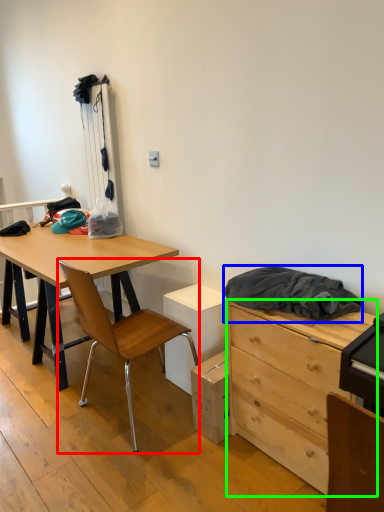
Question: Based on their relative distances, which object is farther from chair (highlighted by a red box)? Choose from clothing (highlighted by a blue box) and chest of drawers (highlighted by a green box).

Choices:
 (A) clothing
 (B) chest of drawers

Answer: (A)